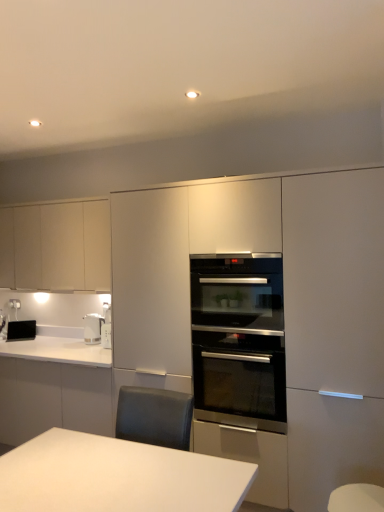
This screenshot has width=384, height=512. Describe the element at coordinates (284, 329) in the screenshot. I see `matte white oven at center, which is counted as the 2th cabinetry, starting from the left` at that location.

In order to click on stainless steel oven at center in this screenshot , I will do `click(239, 340)`.

This screenshot has height=512, width=384. Describe the element at coordinates (54, 388) in the screenshot. I see `white glossy countertop at lower left` at that location.

Describe the element at coordinates (21, 330) in the screenshot. I see `black glossy toaster at lower left` at that location.

Locate an element on the screen. Image resolution: width=384 pixels, height=512 pixels. stainless steel oven at center is located at coordinates (238, 292).

Image resolution: width=384 pixels, height=512 pixels. What are the coordinates of `matte white cabinets at left, which ranks as the 1th cabinetry in left-to-right order` in the screenshot? It's located at (56, 246).

Between stainless steel oven at center and white glossy countertop at lower left, which one appears on the right side from the viewer's perspective?

stainless steel oven at center is more to the right.

Consider the image. Is stainless steel oven at center taller than white glossy countertop at lower left?

Incorrect, the height of stainless steel oven at center is not larger of that of white glossy countertop at lower left.

Is stainless steel oven at center placed right next to white glossy countertop at lower left?

stainless steel oven at center and white glossy countertop at lower left are clearly separated.

Considering the positions of points (262, 373) and (94, 396), is point (262, 373) closer to camera compared to point (94, 396)?

Yes, point (262, 373) is in front of point (94, 396).

Between stainless steel oven at center and matte white cabinets at left, marked as the first cabinetry in a back-to-front arrangement, which one has smaller width?

matte white cabinets at left, marked as the first cabinetry in a back-to-front arrangement, is thinner.

Can you tell me how much stainless steel oven at center and matte white cabinets at left, the 2th cabinetry when ordered from right to left, differ in facing direction?

0.239 degrees.

From the image's perspective, which one is positioned lower, stainless steel oven at center or matte white cabinets at left, which ranks as the 1th cabinetry in left-to-right order?

stainless steel oven at center is shown below in the image.

From a real-world perspective, is stainless steel oven at center over matte white cabinets at left, the 2th cabinetry when ordered from right to left?

Incorrect, from a real-world perspective, stainless steel oven at center is lower than matte white cabinets at left, the 2th cabinetry when ordered from right to left.

Between stainless steel oven at center and black glossy toaster at lower left, which one has larger size?

Bigger between the two is stainless steel oven at center.

Does stainless steel oven at center appear on the left side of black glossy toaster at lower left?

No.

At what (x,y) coordinates should I click in order to perform the action: click on appliance above the stainless steel oven at center (from a real-world perspective). Please return your answer as a coordinate pair (x, y). This screenshot has width=384, height=512. Looking at the image, I should click on (21, 330).

From a real-world perspective, is black glossy toaster at lower left below white glossy countertop at lower left?

Incorrect, from a real-world perspective, black glossy toaster at lower left is higher than white glossy countertop at lower left.

In the image, is black glossy toaster at lower left on the left side or the right side of white glossy countertop at lower left?

black glossy toaster at lower left is positioned on white glossy countertop at lower left's left side.

Does point (32, 336) come farther from viewer compared to point (44, 373)?

Yes, point (32, 336) is farther from viewer.

Looking at their sizes, would you say black glossy toaster at lower left is wider or thinner than white glossy countertop at lower left?

In the image, black glossy toaster at lower left appears to be more narrow than white glossy countertop at lower left.

From a real-world perspective, between white glossy electric kettle at left and stainless steel oven at center, who is vertically lower?

stainless steel oven at center.

Does white glossy electric kettle at left have a greater height compared to stainless steel oven at center?

Incorrect, the height of white glossy electric kettle at left is not larger of that of stainless steel oven at center.

Is white glossy electric kettle at left wider than stainless steel oven at center?

No.

Would you say white glossy electric kettle at left is a long distance from matte white cabinets at left, marked as the first cabinetry in a back-to-front arrangement?

No, white glossy electric kettle at left is not far from matte white cabinets at left, marked as the first cabinetry in a back-to-front arrangement.

From a real-world perspective, is white glossy electric kettle at left located higher than matte white cabinets at left, which ranks as the 1th cabinetry in left-to-right order?

Actually, white glossy electric kettle at left is physically below matte white cabinets at left, which ranks as the 1th cabinetry in left-to-right order, in the real world.

Locate an element on the screen. The width and height of the screenshot is (384, 512). the 2nd cabinetry above the white glossy electric kettle at left (from the image's perspective) is located at coordinates (56, 246).

From the image's perspective, between white glossy countertop at lower left and stainless steel oven at center, who is located below?

white glossy countertop at lower left, from the image's perspective.

What's the angular difference between white glossy countertop at lower left and stainless steel oven at center's facing directions?

There is a 0.911-degree angle between the facing directions of white glossy countertop at lower left and stainless steel oven at center.

Can you see white glossy countertop at lower left touching stainless steel oven at center?

white glossy countertop at lower left and stainless steel oven at center are not in contact.

Who is shorter, white glossy countertop at lower left or stainless steel oven at center?

stainless steel oven at center is shorter.

The image size is (384, 512). I want to click on countertop that appears below the stainless steel oven at center (from a real-world perspective), so click(x=54, y=388).

The width and height of the screenshot is (384, 512). Identify the location of cabinetry behind the stainless steel oven at center. (56, 246).

From the image, which object appears to be nearer to matte white oven at center, which is the 2th cabinetry from back to front, black glossy toaster at lower left or white glossy countertop at lower left?

white glossy countertop at lower left is positioned closer to the anchor matte white oven at center, which is the 2th cabinetry from back to front.

Which object lies further to the anchor point white glossy countertop at lower left, matte white cabinets at left, the 2th cabinetry when ordered from right to left, or matte white oven at center, the first cabinetry viewed from the front?

Among the two, matte white cabinets at left, the 2th cabinetry when ordered from right to left, is located further to white glossy countertop at lower left.

Estimate the real-world distances between objects in this image. Which object is further from white glossy countertop at lower left, white glossy electric kettle at left or black glossy toaster at lower left?

black glossy toaster at lower left is positioned further to the anchor white glossy countertop at lower left.

Based on their spatial positions, is stainless steel oven at center or stainless steel oven at center closer to white glossy electric kettle at left?

The object closer to white glossy electric kettle at left is stainless steel oven at center.

Which object lies nearer to the anchor point black glossy toaster at lower left, stainless steel oven at center or matte white oven at center, the first cabinetry viewed from the front?

matte white oven at center, the first cabinetry viewed from the front, is closer to black glossy toaster at lower left.

From the image, which object appears to be nearer to matte white oven at center, the first cabinetry when ordered from right to left, white glossy electric kettle at left or stainless steel oven at center?

Based on the image, stainless steel oven at center appears to be nearer to matte white oven at center, the first cabinetry when ordered from right to left.

Looking at the image, which one is located further to stainless steel oven at center, matte white cabinets at left, which ranks as the 1th cabinetry in left-to-right order, or matte white oven at center, the first cabinetry when ordered from right to left?

matte white cabinets at left, which ranks as the 1th cabinetry in left-to-right order, is positioned further to the anchor stainless steel oven at center.

Looking at the image, which one is located closer to white glossy countertop at lower left, matte white oven at center, the first cabinetry viewed from the front, or black glossy toaster at lower left?

matte white oven at center, the first cabinetry viewed from the front.

Identify the location of home appliance between matte white cabinets at left, the 2th cabinetry when ordered from right to left, and stainless steel oven at center, in the horizontal direction. (93, 328).

Locate an element on the screen. The height and width of the screenshot is (512, 384). kitchen appliance located between matte white oven at center, which is the 2th cabinetry from back to front, and white glossy electric kettle at left in the depth direction is located at coordinates (239, 340).

Where is `kitchen appliance situated between white glossy countertop at lower left and matte white oven at center, which is counted as the 2th cabinetry, starting from the left, from left to right`? Image resolution: width=384 pixels, height=512 pixels. kitchen appliance situated between white glossy countertop at lower left and matte white oven at center, which is counted as the 2th cabinetry, starting from the left, from left to right is located at coordinates (239, 340).

Locate an element on the screen. Image resolution: width=384 pixels, height=512 pixels. cabinetry situated between black glossy toaster at lower left and matte white oven at center, which is the 2th cabinetry from back to front, from left to right is located at coordinates (56, 246).